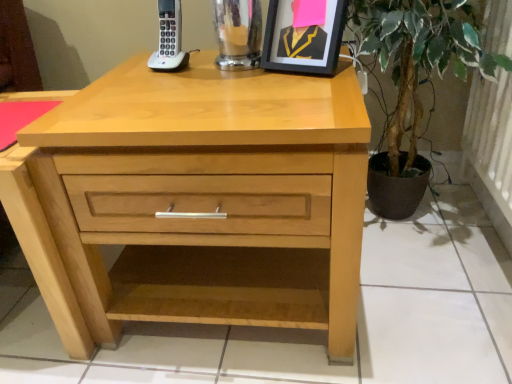
Image resolution: width=512 pixels, height=384 pixels. Identify the location of vacant area situated below green leafy plant at right (from a real-world perspective). (416, 230).